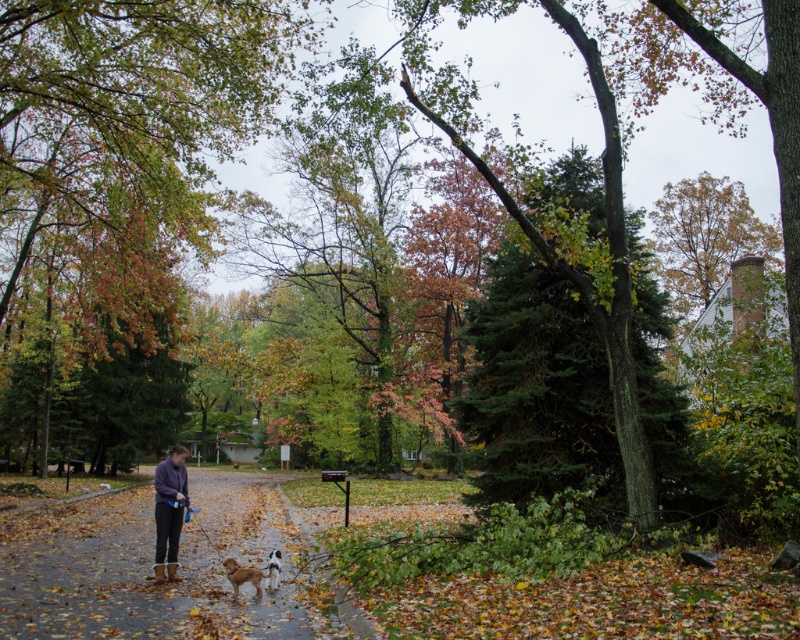
Question: Observing the image, what is the correct spatial positioning of green textured evergreen tree at center in reference to golden fur dog at center?

Choices:
 (A) above
 (B) below

Answer: (A)

Question: Does dark gray asphalt path at lower left appear over matte purple sweater at center?

Choices:
 (A) yes
 (B) no

Answer: (B)

Question: Estimate the real-world distances between objects in this image. Which object is farther from the golden fur dog at center?

Choices:
 (A) dark gray asphalt path at lower left
 (B) matte purple sweater at center

Answer: (A)

Question: Considering the real-world distances, which object is farthest from the green textured evergreen tree at center?

Choices:
 (A) golden fur dog at center
 (B) dark gray asphalt path at lower left
 (C) white fur dog at lower center
 (D) matte purple sweater at center

Answer: (D)

Question: Which point is farther to the camera?

Choices:
 (A) pyautogui.click(x=576, y=465)
 (B) pyautogui.click(x=276, y=557)
 (C) pyautogui.click(x=104, y=524)
 (D) pyautogui.click(x=173, y=476)

Answer: (C)

Question: Does green textured evergreen tree at center come in front of golden fur dog at center?

Choices:
 (A) yes
 (B) no

Answer: (B)